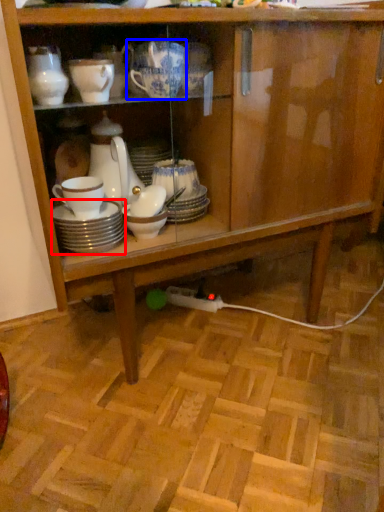
Question: Which object appears closest to the camera in this image, tableware (highlighted by a red box) or tableware (highlighted by a blue box)?

Choices:
 (A) tableware
 (B) tableware

Answer: (B)